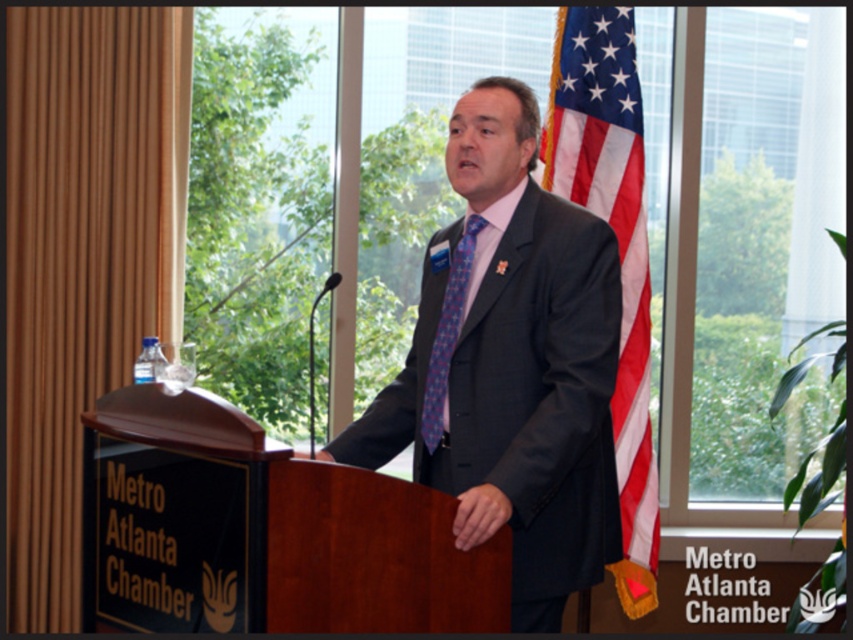
Looking at this image, you are a photographer standing at the camera position. You want to take a photo of the man at the podium but need to ensure the american flag at right is not in the frame. Given that the flag is 3.30 meters away from your current position, can you estimate if moving forward by 1 meter will keep the flag out of the shot?

Moving forward by 1 meter would reduce the distance to the american flag at right to 2.30 meters. However, without knowing the camera lens angle or field of view, it is impossible to definitively determine if the flag would be excluded from the frame. Adjust your position or use a zoom lens to frame the subject while excluding the flag.